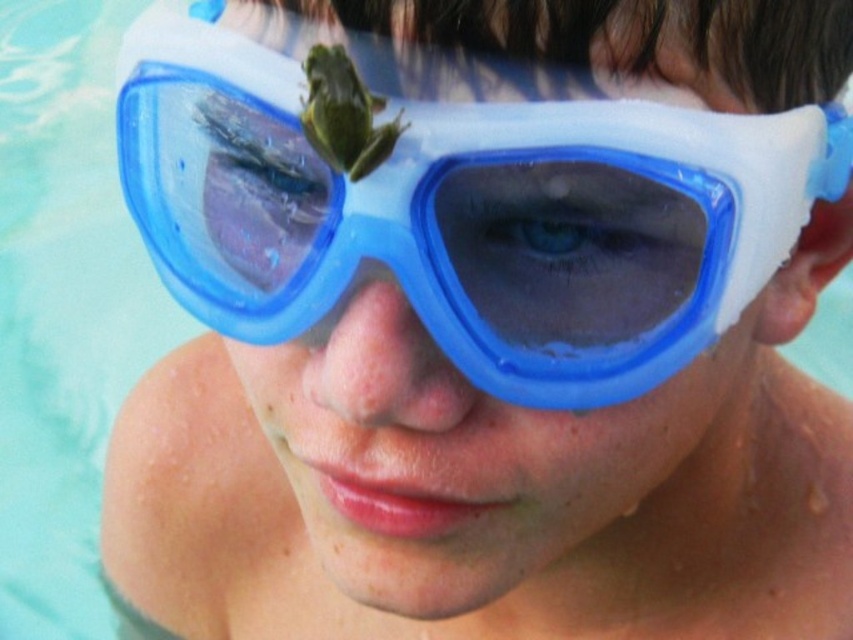
Does transparent plastic goggles at center appear under blue plastic goggles at center?

Indeed, transparent plastic goggles at center is positioned under blue plastic goggles at center.

Is point (498, 628) positioned after point (468, 289)?

Yes, it is behind point (468, 289).

Which is behind, point (310, 445) or point (422, 189)?

The point (310, 445) is more distant.

Locate an element on the screen. transparent plastic goggles at center is located at coordinates (477, 502).